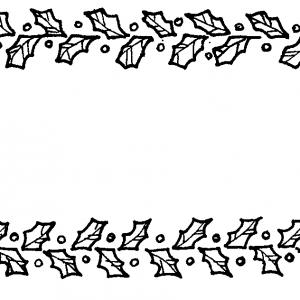
Image resolution: width=300 pixels, height=300 pixels. Find the location of `lower panel`. lower panel is located at coordinates (80, 215).